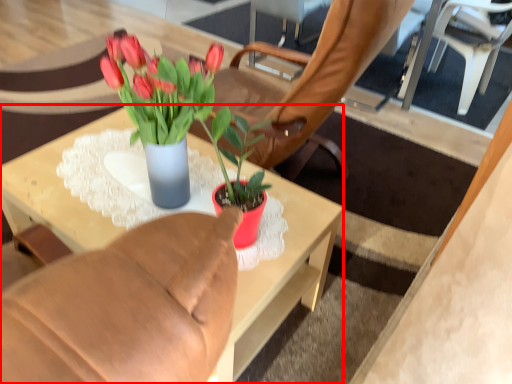
Question: From the image, what is the correct spatial relationship of desk (annotated by the red box) in relation to chair?

Choices:
 (A) right
 (B) left

Answer: (B)